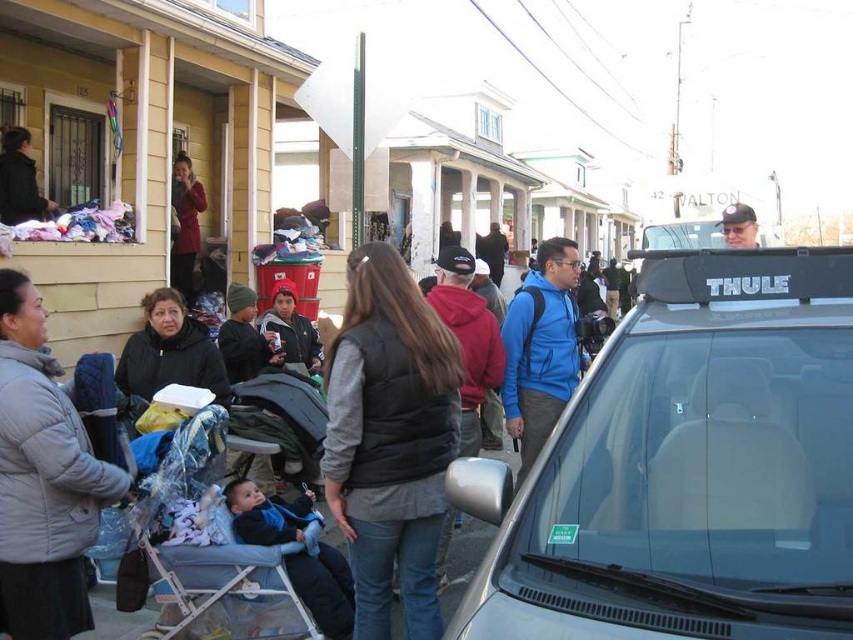
You are a delivery person who needs to place a small package on the dark gray vest at center and the blue fabric baby carrier at lower left. Which object can you place the package on without it falling off?

The dark gray vest at center is bigger than the blue fabric baby carrier at lower left, so the package can be placed on the dark gray vest at center without falling off.

You are standing at the point with coordinates point (x=373, y=346) and want to walk to the silver car with Thule roof rack parked near the curb. Will you pass by point (x=683, y=339) on your way?

Yes, because point (x=683, y=339) is in front of point (x=373, y=346), so walking towards the silver car with Thule roof rack would require passing through point (x=683, y=339) first.

You are a delivery person trying to determine which item is taller between the dark gray vest at center and the blue fabric baby carrier at lower left. Based on the scene, which one is taller?

The dark gray vest at center is taller than the blue fabric baby carrier at lower left according to the description.